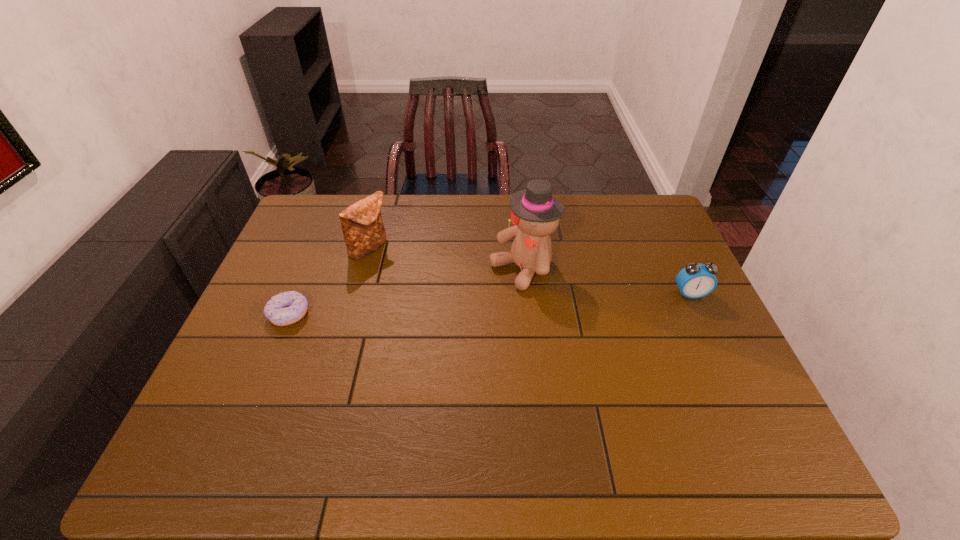
In the image, there is a desktop. Where is `vacant space at the near edge`? The height and width of the screenshot is (540, 960). vacant space at the near edge is located at coordinates (665, 410).

Image resolution: width=960 pixels, height=540 pixels. Identify the location of free region at the left edge of the desktop. (245, 356).

Find the location of `free space at the right edge of the desktop`. free space at the right edge of the desktop is located at coordinates (671, 248).

The image size is (960, 540). Identify the location of vacant region at the far left corner of the desktop. (321, 213).

Find the location of a particular element. The image size is (960, 540). free space between the rag_doll and the shortest object is located at coordinates (406, 292).

You are a GUI agent. You are given a task and a screenshot of the screen. Output one action in this format:
    pyautogui.click(x=<x>, y=<y>)
    Task: Click on the free point between the second object from right to left and the second shortest object
    This screenshot has width=960, height=540.
    Given the screenshot: What is the action you would take?
    click(x=607, y=281)

Where is `empty space between the alarm clock and the rag_doll`? empty space between the alarm clock and the rag_doll is located at coordinates (607, 281).

I want to click on vacant space that is in between the rightmost object and the rag_doll, so click(607, 281).

You are a GUI agent. You are given a task and a screenshot of the screen. Output one action in this format:
    pyautogui.click(x=<x>, y=<y>)
    Task: Click on the empty location between the doughnut and the tallest object
    The width and height of the screenshot is (960, 540).
    Given the screenshot: What is the action you would take?
    point(406,292)

Where is `object that is the closest one to the doughnut`? object that is the closest one to the doughnut is located at coordinates (363, 230).